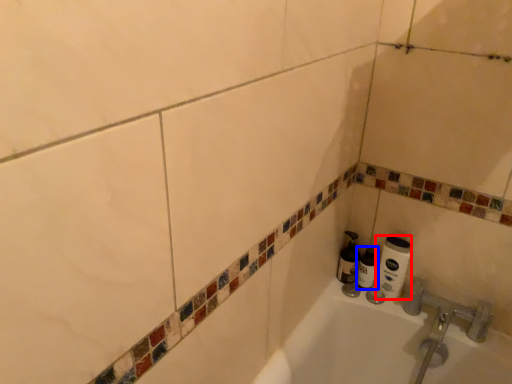
Question: Which object is further to the camera taking this photo, toilet paper (highlighted by a red box) or shaving cream (highlighted by a blue box)?

Choices:
 (A) toilet paper
 (B) shaving cream

Answer: (B)